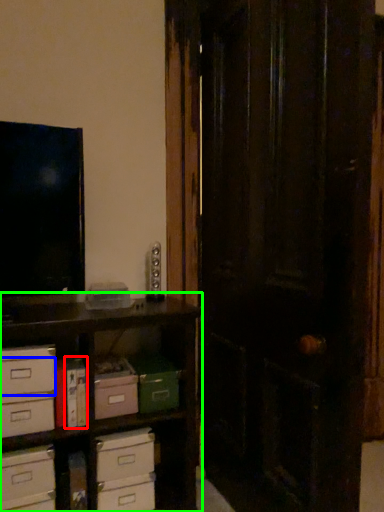
Question: Based on their relative distances, which object is farther from book (highlighted by a red box)? Choose from drawer (highlighted by a blue box) and shelf (highlighted by a green box).

Choices:
 (A) drawer
 (B) shelf

Answer: (B)